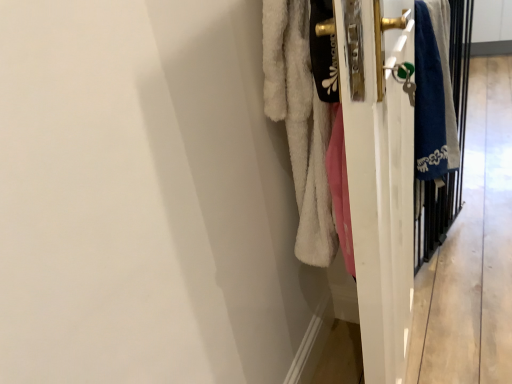
Locate an element on the screen. The height and width of the screenshot is (384, 512). blue fabric screen door at right is located at coordinates [x=458, y=146].

In order to click on white fluffy towel at right in this screenshot , I will do `click(298, 122)`.

What is the approximate width of blue towel at right?

It is 6.06 inches.

The height and width of the screenshot is (384, 512). What are the coordinates of `blue fabric screen door at right` in the screenshot? It's located at (458, 146).

Which is in front, blue fabric screen door at right or blue towel at right?

blue fabric screen door at right is closer to the camera.

Identify the location of screen door that appears above the blue towel at right (from a real-world perspective). This screenshot has width=512, height=384. (458, 146).

Between blue fabric screen door at right and blue towel at right, which one has larger width?

blue fabric screen door at right is wider.

How different are the orientations of blue fabric screen door at right and blue towel at right in degrees?

blue fabric screen door at right and blue towel at right are facing 0.00164 degrees away from each other.

Is white fluffy towel at right oriented away from blue towel at right?

white fluffy towel at right is not turned away from blue towel at right.

Which of these two, white fluffy towel at right or blue towel at right, is wider?

Wider between the two is white fluffy towel at right.

Considering the positions of point (455, 52) and point (487, 64), is point (455, 52) closer or farther from the camera than point (487, 64)?

Point (455, 52) is closer to the camera than point (487, 64).

Is white fluffy towel at right outside of blue towel at right?

Yes, white fluffy towel at right is not within blue towel at right.

Identify the location of screen door behind the white fluffy towel at right. This screenshot has width=512, height=384. (458, 146).

How far apart are blue fabric screen door at right and white fluffy towel at right?

blue fabric screen door at right and white fluffy towel at right are 7.12 inches apart.

Can you confirm if blue fabric screen door at right is smaller than white fluffy towel at right?

Correct, blue fabric screen door at right occupies less space than white fluffy towel at right.

Which is closer to the camera, (431, 197) or (460, 92)?

Point (431, 197).

Which is nearer, (306, 32) or (436, 219)?

The point (306, 32) is closer to the camera.

From the image's perspective, which is above, white fluffy towel at right or blue fabric screen door at right?

blue fabric screen door at right.

Can you see white fluffy towel at right touching blue fabric screen door at right?

No, white fluffy towel at right is not beside blue fabric screen door at right.

Consider the image. From their relative heights in the image, would you say white fluffy towel at right is taller or shorter than blue fabric screen door at right?

Considering their sizes, white fluffy towel at right has more height than blue fabric screen door at right.

Find the location of a particular element. corridor on the right side of blue fabric screen door at right is located at coordinates pos(472,252).

Can you tell me how much blue towel at right and blue fabric screen door at right differ in facing direction?

blue towel at right and blue fabric screen door at right are facing 0.00164 degrees away from each other.

In the scene shown: Does blue towel at right turn towards blue fabric screen door at right?

Yes, blue towel at right is facing blue fabric screen door at right.

Is the position of blue towel at right less distant than that of blue fabric screen door at right?

No, the depth of blue towel at right is greater than that of blue fabric screen door at right.

From a real-world perspective, is blue towel at right positioned under white fluffy towel at right based on gravity?

Yes, from a real-world perspective, blue towel at right is below white fluffy towel at right.

Is blue towel at right to the right of white fluffy towel at right from the viewer's perspective?

Yes.

Consider the image. Does blue towel at right have a greater height compared to white fluffy towel at right?

No, blue towel at right is not taller than white fluffy towel at right.

You are a GUI agent. You are given a task and a screenshot of the screen. Output one action in this format:
    pyautogui.click(x=<x>, y=<y>)
    Task: Click on the screen door that appears above the blue towel at right (from the image's perspective)
    Image resolution: width=512 pixels, height=384 pixels.
    Given the screenshot: What is the action you would take?
    pyautogui.click(x=458, y=146)

Identify the location of corridor beneath the white fluffy towel at right (from a real-world perspective). The height and width of the screenshot is (384, 512). (472, 252).

From the image, which object appears to be nearer to white fluffy towel at right, blue towel at right or blue fabric screen door at right?

blue fabric screen door at right is positioned closer to the anchor white fluffy towel at right.

Based on the photo, from the image, which object appears to be farther from white fluffy towel at right, blue fabric screen door at right or blue towel at right?

Based on the image, blue towel at right appears to be further to white fluffy towel at right.

Based on their spatial positions, is blue fabric screen door at right or white fluffy towel at right closer to blue towel at right?

Among the two, blue fabric screen door at right is located nearer to blue towel at right.

When comparing their distances from blue fabric screen door at right, does blue towel at right or white fluffy towel at right seem closer?

Among the two, white fluffy towel at right is located nearer to blue fabric screen door at right.

Looking at the image, which one is located further to blue fabric screen door at right, white fluffy towel at right or blue towel at right?

blue towel at right is positioned further to the anchor blue fabric screen door at right.

From the image, which object appears to be farther from blue towel at right, white fluffy towel at right or blue fabric screen door at right?

Among the two, white fluffy towel at right is located further to blue towel at right.

Where is `screen door between white fluffy towel at right and blue towel at right along the z-axis`? The width and height of the screenshot is (512, 384). screen door between white fluffy towel at right and blue towel at right along the z-axis is located at coordinates pos(458,146).